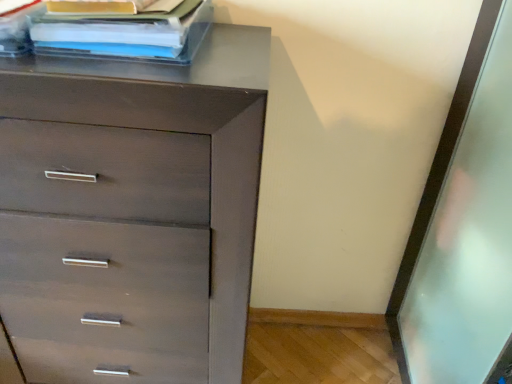
Question: Should I look upward or downward to see matte plastic book at upper left?

Choices:
 (A) up
 (B) down

Answer: (A)

Question: From a real-world perspective, does matte brown chest of drawers at upper left sit lower than matte plastic book at upper left?

Choices:
 (A) no
 (B) yes

Answer: (B)

Question: Is matte brown chest of drawers at upper left at the right side of matte plastic book at upper left?

Choices:
 (A) yes
 (B) no

Answer: (B)

Question: Can we say matte brown chest of drawers at upper left lies outside matte plastic book at upper left?

Choices:
 (A) no
 (B) yes

Answer: (B)

Question: Does matte brown chest of drawers at upper left have a lesser height compared to matte plastic book at upper left?

Choices:
 (A) yes
 (B) no

Answer: (B)

Question: Is matte brown chest of drawers at upper left with matte plastic book at upper left?

Choices:
 (A) no
 (B) yes

Answer: (A)

Question: Is there a large distance between matte brown chest of drawers at upper left and matte plastic book at upper left?

Choices:
 (A) yes
 (B) no

Answer: (B)

Question: Does matte plastic book at upper left have a greater width compared to matte brown chest of drawers at upper left?

Choices:
 (A) no
 (B) yes

Answer: (A)

Question: Does matte plastic book at upper left have a lesser width compared to matte brown chest of drawers at upper left?

Choices:
 (A) yes
 (B) no

Answer: (A)

Question: Considering the relative sizes of matte plastic book at upper left and matte brown chest of drawers at upper left in the image provided, is matte plastic book at upper left smaller than matte brown chest of drawers at upper left?

Choices:
 (A) yes
 (B) no

Answer: (A)

Question: From a real-world perspective, is matte plastic book at upper left over matte brown chest of drawers at upper left?

Choices:
 (A) yes
 (B) no

Answer: (A)

Question: Is matte plastic book at upper left facing away from matte brown chest of drawers at upper left?

Choices:
 (A) no
 (B) yes

Answer: (A)

Question: Considering the relative sizes of matte plastic book at upper left and matte brown chest of drawers at upper left in the image provided, is matte plastic book at upper left bigger than matte brown chest of drawers at upper left?

Choices:
 (A) yes
 (B) no

Answer: (B)

Question: In terms of size, does matte brown chest of drawers at upper left appear bigger or smaller than matte plastic book at upper left?

Choices:
 (A) small
 (B) big

Answer: (B)